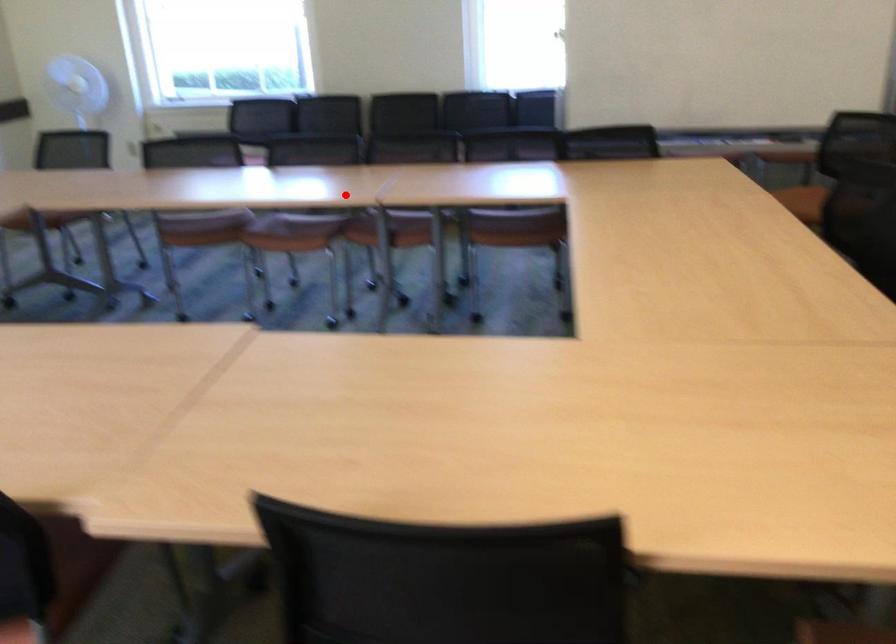
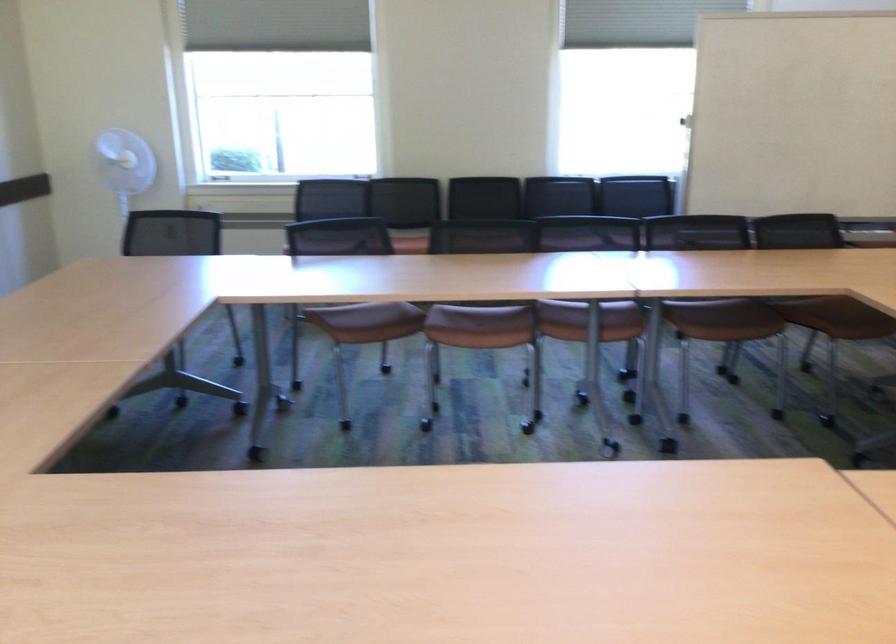
Question: I am providing you with two images of the same scene from different viewpoints. A red point is shown in image1. For the corresponding object point in image2, is it positioned nearer or farther from the camera?

Choices:
 (A) Nearer
 (B) Farther

Answer: (A)